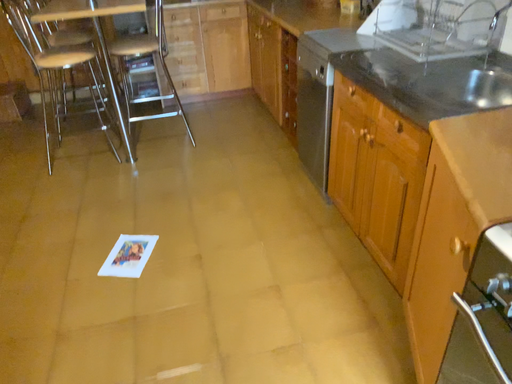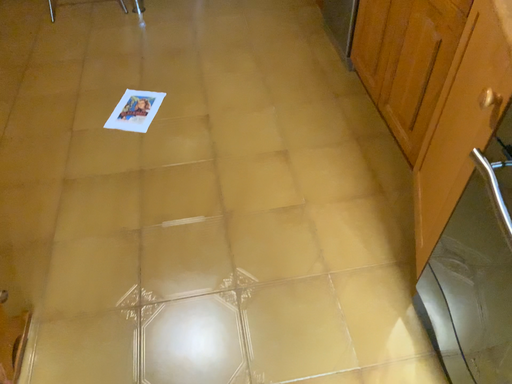
Question: Which way did the camera rotate in the video?

Choices:
 (A) rotated downward
 (B) rotated upward

Answer: (A)